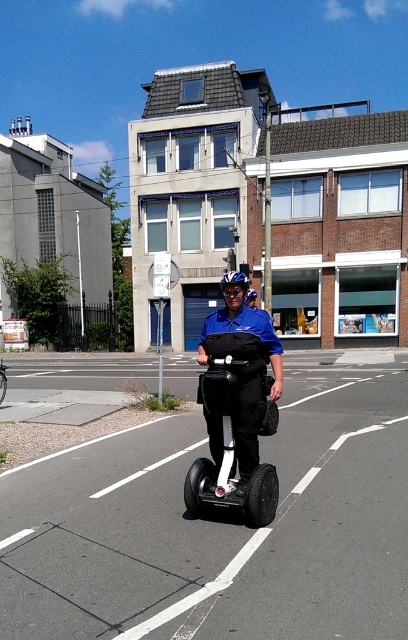
Is matte blue uniform at center smaller than white glossy scooter at center?

Actually, matte blue uniform at center might be larger than white glossy scooter at center.

In the scene shown: Can you confirm if matte blue uniform at center is wider than white glossy scooter at center?

Yes, matte blue uniform at center is wider than white glossy scooter at center.

Is point (250, 442) closer to camera compared to point (232, 390)?

No, (250, 442) is behind (232, 390).

The height and width of the screenshot is (640, 408). Find the location of `matte blue uniform at center`. matte blue uniform at center is located at coordinates (243, 365).